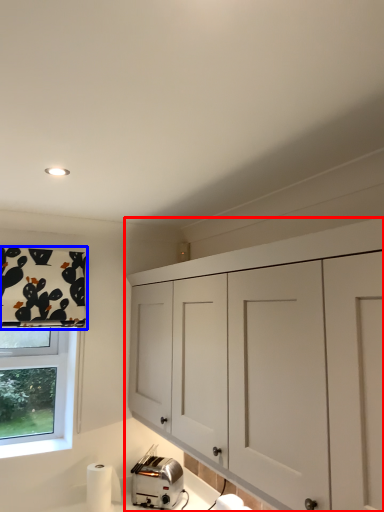
Question: Which point is further to the camera, cabinetry (highlighted by a red box) or curtain (highlighted by a blue box)?

Choices:
 (A) cabinetry
 (B) curtain

Answer: (B)